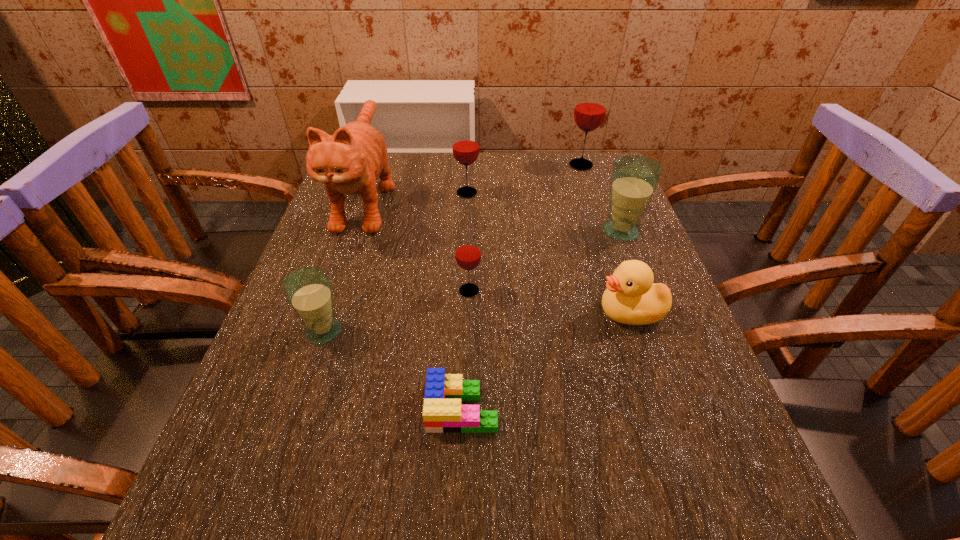
Find the location of a particular element. vacant space that's between the ginger cat and the nearer blue glass is located at coordinates (345, 264).

In order to click on free space between the leftmost glass and the shortest object in this screenshot , I will do `click(393, 370)`.

Locate an element on the screen. vacant area between the green Lego and the bigger blue glass is located at coordinates (541, 320).

Locate an element on the screen. This screenshot has height=540, width=960. vacant space in between the nearest object and the smallest red glass is located at coordinates (466, 349).

Locate an element on the screen. object that is the nearest to the tallest object is located at coordinates (465, 146).

The width and height of the screenshot is (960, 540). What are the coordinates of `the second closest object to the smaller blue glass` in the screenshot? It's located at (350, 161).

The height and width of the screenshot is (540, 960). What are the coordinates of `the fourth closest glass to the right blue glass` in the screenshot? It's located at 308,290.

Identify which glass is the fourth closest to the leftmost glass. Please provide its 2D coordinates. Your answer should be formatted as a tuple, i.e. [(x, y)], where the tuple contains the x and y coordinates of a point satisfying the conditions above.

[(590, 108)]

Find the location of a particular element. This screenshot has height=540, width=960. red glass that is the third closest one to the nearest object is located at coordinates (590, 108).

In order to click on red glass that is the closest to the leftmost glass in this screenshot , I will do `click(468, 255)`.